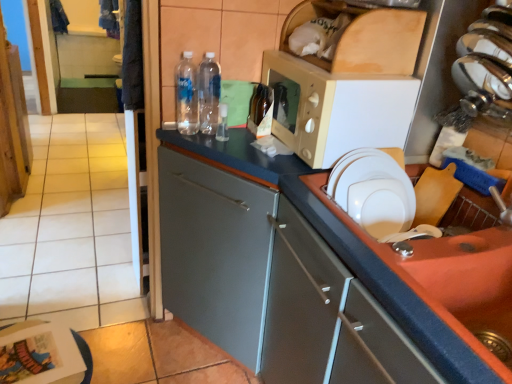
The width and height of the screenshot is (512, 384). In order to click on free location to the right of transparent plastic bottles at center, placed as the 2th bottle when sorted from right to left in this screenshot , I will do `click(239, 138)`.